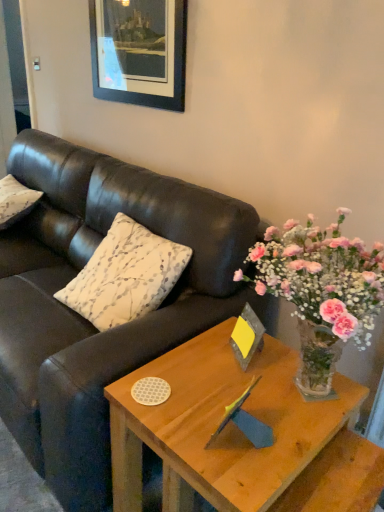
Identify the location of free spot above light brown wood coffee table at center (from a real-world perspective). The image size is (384, 512). (229, 391).